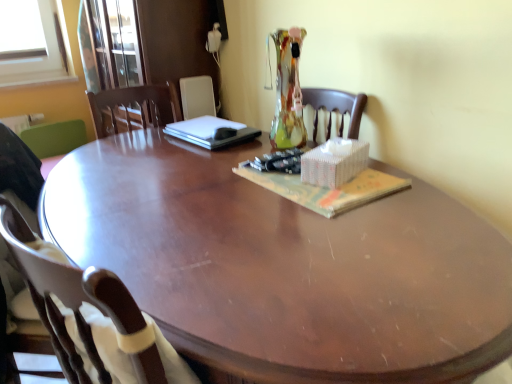
You are a GUI agent. You are given a task and a screenshot of the screen. Output one action in this format:
    pyautogui.click(x=<x>, y=<y>)
    Task: Click on the vacant area to the left of matte paper magazine at center
    The height and width of the screenshot is (384, 512).
    Given the screenshot: What is the action you would take?
    pyautogui.click(x=200, y=190)